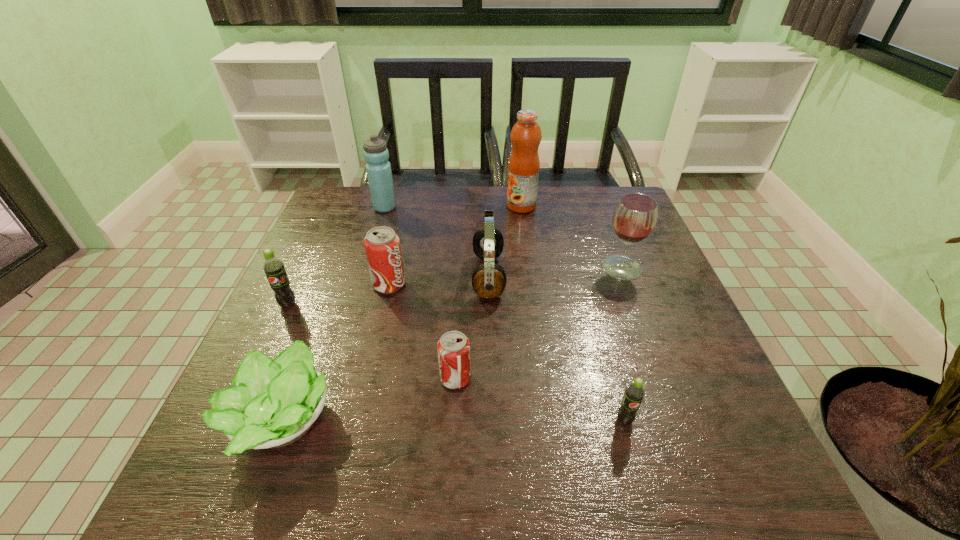
Locate an element on the screen. This screenshot has height=540, width=960. the seventh object from left to right is located at coordinates (523, 168).

At what (x,y) coordinates should I click in order to perform the action: click on fruit juice. Please return your answer as a coordinate pair (x, y). Looking at the image, I should click on (523, 168).

Locate an element on the screen. This screenshot has width=960, height=540. the eighth shortest object is located at coordinates (378, 168).

Image resolution: width=960 pixels, height=540 pixels. In order to click on red wineglass in this screenshot , I will do `click(634, 218)`.

I want to click on the rightmost object, so tap(634, 218).

At what (x,y) coordinates should I click in order to perform the action: click on headset. Please return your answer as a coordinate pair (x, y). Looking at the image, I should click on 488,279.

The height and width of the screenshot is (540, 960). Identify the location of the third nearest soda. (273, 267).

The width and height of the screenshot is (960, 540). I want to click on the farther green soda, so click(x=273, y=267).

You are a GUI agent. You are given a task and a screenshot of the screen. Output one action in this format:
    pyautogui.click(x=<x>, y=<y>)
    Task: Click on the third soda from right to left
    
    Given the screenshot: What is the action you would take?
    pyautogui.click(x=382, y=245)

The width and height of the screenshot is (960, 540). I want to click on the left pink soda can, so click(x=382, y=245).